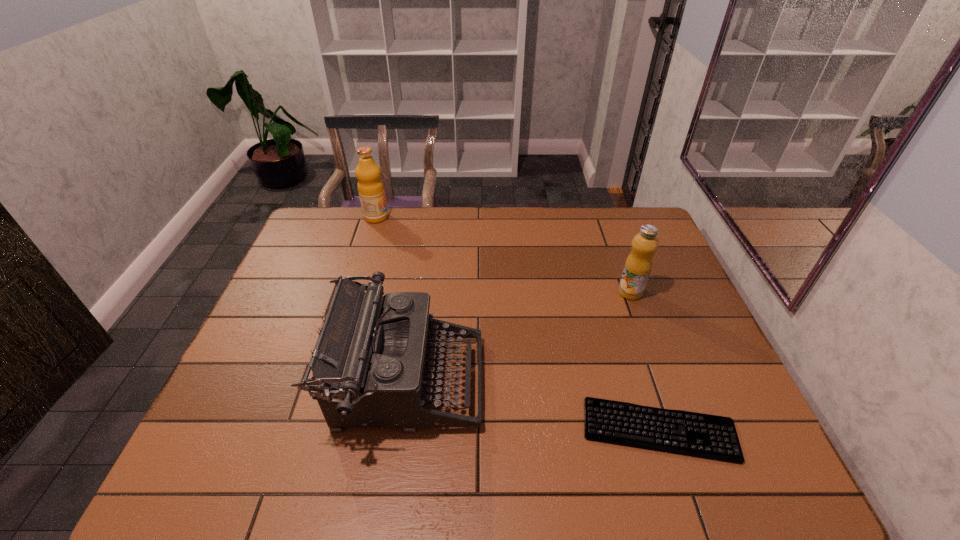
This screenshot has width=960, height=540. Find the location of `object located at the far edge`. object located at the far edge is located at coordinates (371, 191).

I want to click on typewriter situated at the near edge, so click(x=369, y=364).

Locate an element on the screen. computer keyboard located in the near edge section of the desktop is located at coordinates (712, 437).

In order to click on fruit juice situated at the right edge in this screenshot , I will do `click(638, 265)`.

In order to click on computer keyboard that is positioned at the right edge in this screenshot , I will do `click(712, 437)`.

Where is `object that is at the near right corner`? This screenshot has height=540, width=960. object that is at the near right corner is located at coordinates (712, 437).

Image resolution: width=960 pixels, height=540 pixels. What are the coordinates of `vacant area at the far edge of the desktop` in the screenshot? It's located at (365, 244).

Locate an element on the screen. This screenshot has height=540, width=960. vacant space at the near edge is located at coordinates (625, 483).

In the image, there is a desktop. Where is `vacant space at the left edge`? vacant space at the left edge is located at coordinates (209, 436).

In the image, there is a desktop. Where is `free space at the right edge`? Image resolution: width=960 pixels, height=540 pixels. free space at the right edge is located at coordinates (693, 306).